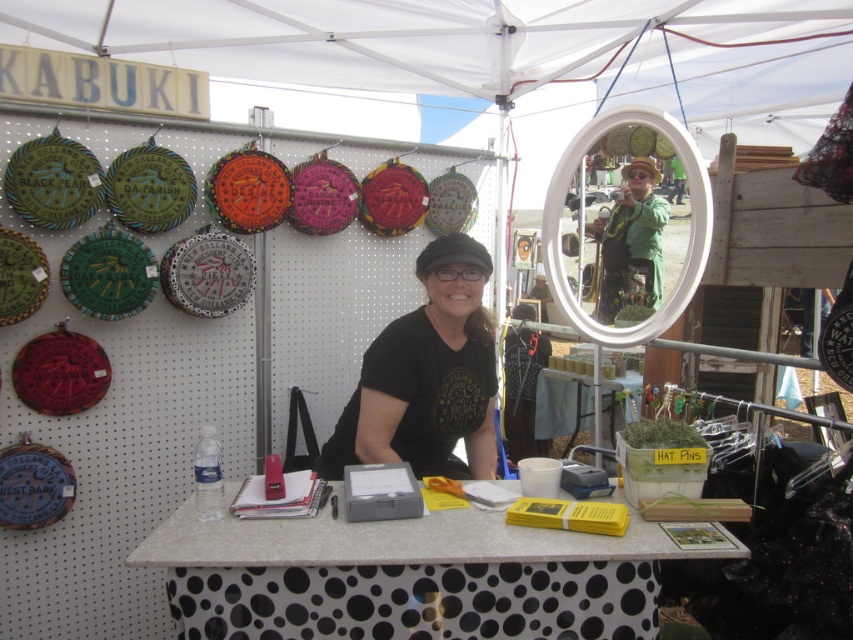
Is black dotted fabric table at center shorter than green fabric jacket at center?

Yes, black dotted fabric table at center is shorter than green fabric jacket at center.

Does point (405, 596) lie in front of point (637, 157)?

Yes.

Find the location of a particular element. black dotted fabric table at center is located at coordinates pos(412,577).

Identify the location of black dotted fabric table at center. The height and width of the screenshot is (640, 853). (412, 577).

Does point (288, 541) come closer to viewer compared to point (471, 284)?

That is True.

Is point (668, 556) in front of point (488, 355)?

Yes, it is in front of point (488, 355).

Where is `black dotted fabric table at center`? This screenshot has width=853, height=640. black dotted fabric table at center is located at coordinates (412, 577).

Measure the distance between black matte t-shirt at center and green fabric jacket at center.

black matte t-shirt at center and green fabric jacket at center are 13.52 feet apart from each other.

Does point (375, 444) come behind point (633, 291)?

No, it is in front of (633, 291).

Describe the element at coordinates (427, 376) in the screenshot. The height and width of the screenshot is (640, 853). I see `black matte t-shirt at center` at that location.

What are the coordinates of `black matte t-shirt at center` in the screenshot? It's located at (427, 376).